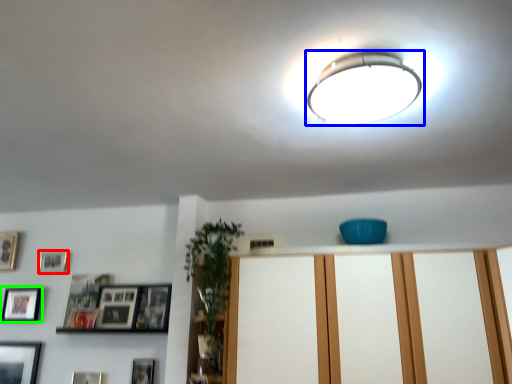
Question: Estimate the real-world distances between objects in this image. Which object is farther from picture frame (highlighted by a red box), lamp (highlighted by a blue box) or picture frame (highlighted by a green box)?

Choices:
 (A) lamp
 (B) picture frame

Answer: (A)